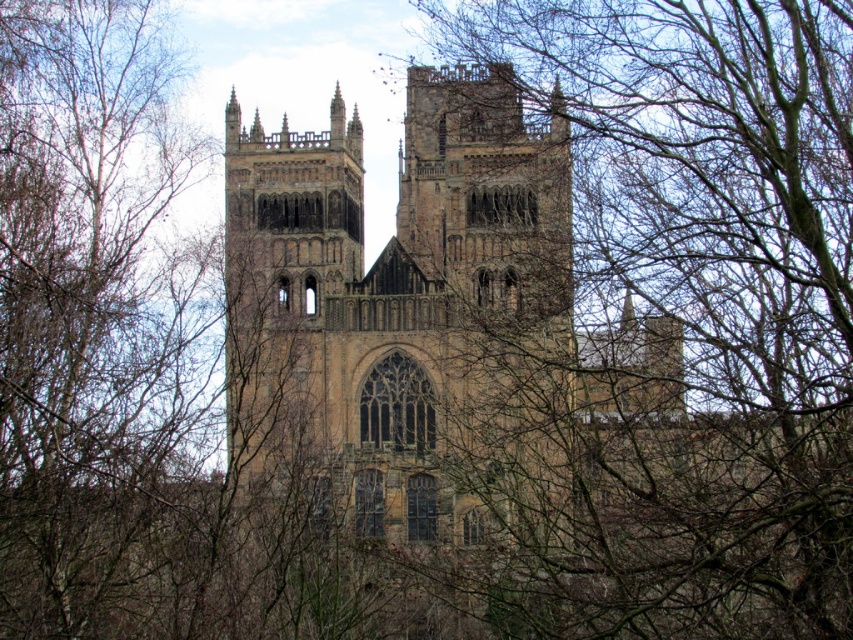
Does point (718, 614) lie behind point (518, 147)?

That is False.

Is brown leafless branches at upper center positioned at the back of brown stone church at center?

That is False.

Who is more distant from viewer, [677,42] or [430,520]?

Point [677,42]

Where is `brown leafless branches at upper center`? Image resolution: width=853 pixels, height=640 pixels. brown leafless branches at upper center is located at coordinates (694, 314).